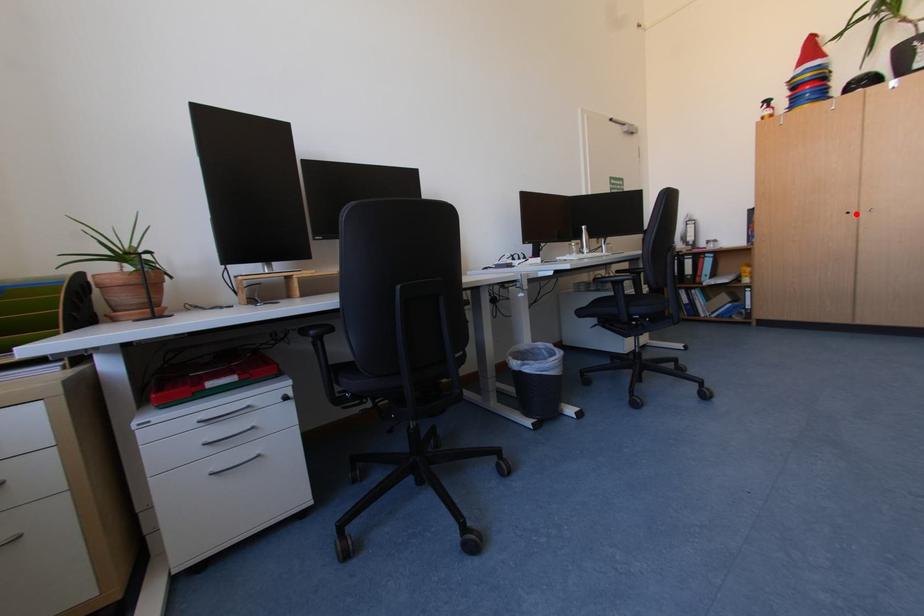
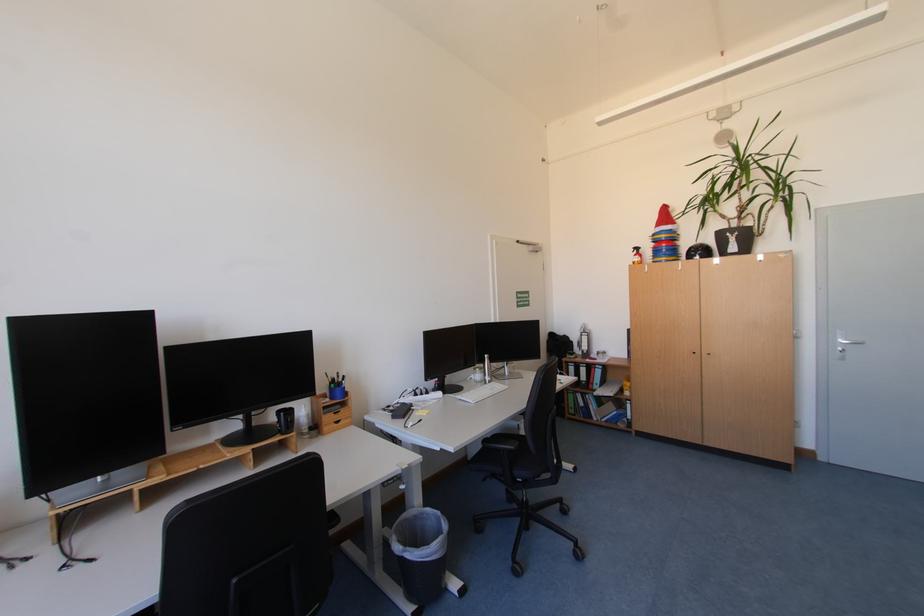
Where in the second image is the point corresponding to the highlighted location from the first image?

(701, 354)